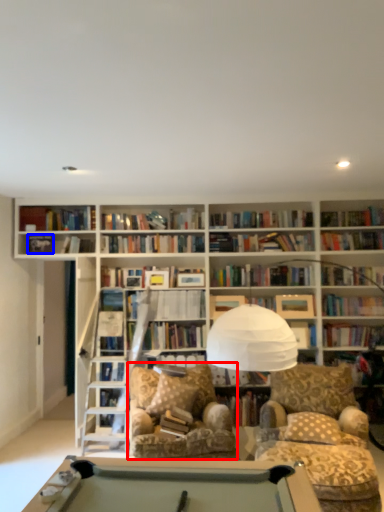
Question: Which object is closer to the camera taking this photo, swivel chair (highlighted by a red box) or paperback book (highlighted by a blue box)?

Choices:
 (A) swivel chair
 (B) paperback book

Answer: (A)